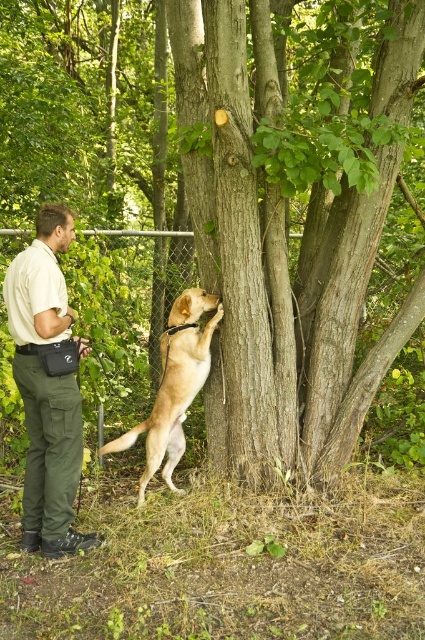
Is point (74, 404) behind point (175, 342)?

No, (74, 404) is in front of (175, 342).

The height and width of the screenshot is (640, 425). What do you see at coordinates (48, 385) in the screenshot?
I see `khaki cotton shirt at center` at bounding box center [48, 385].

Locate an element on the screen. This screenshot has width=425, height=640. khaki cotton shirt at center is located at coordinates (48, 385).